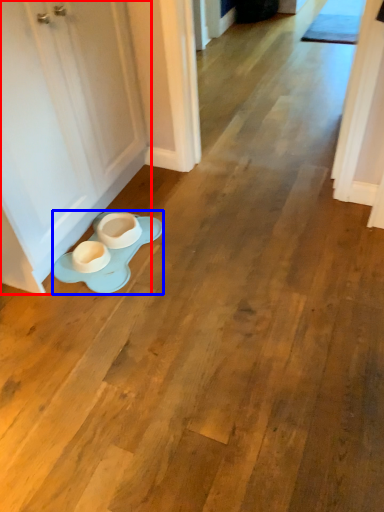
Question: Which object is closer to the camera taking this photo, door (highlighted by a red box) or saucer (highlighted by a blue box)?

Choices:
 (A) door
 (B) saucer

Answer: (A)